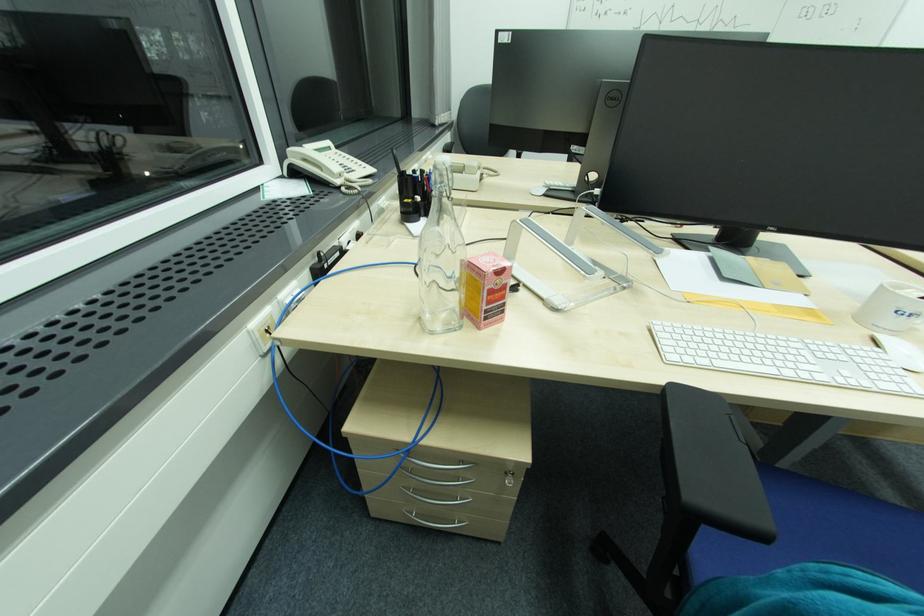
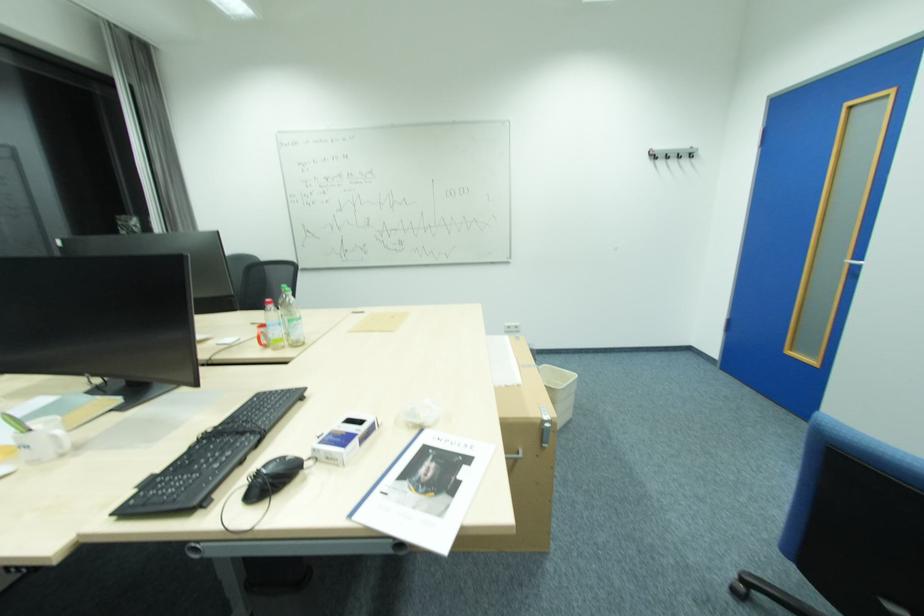
Question: Which direction would the cameraman need to move to produce the second image? Reply with the corresponding letter.

Choices:
 (A) Left
 (B) Right
 (C) Forward
 (D) Backward

Answer: (B)